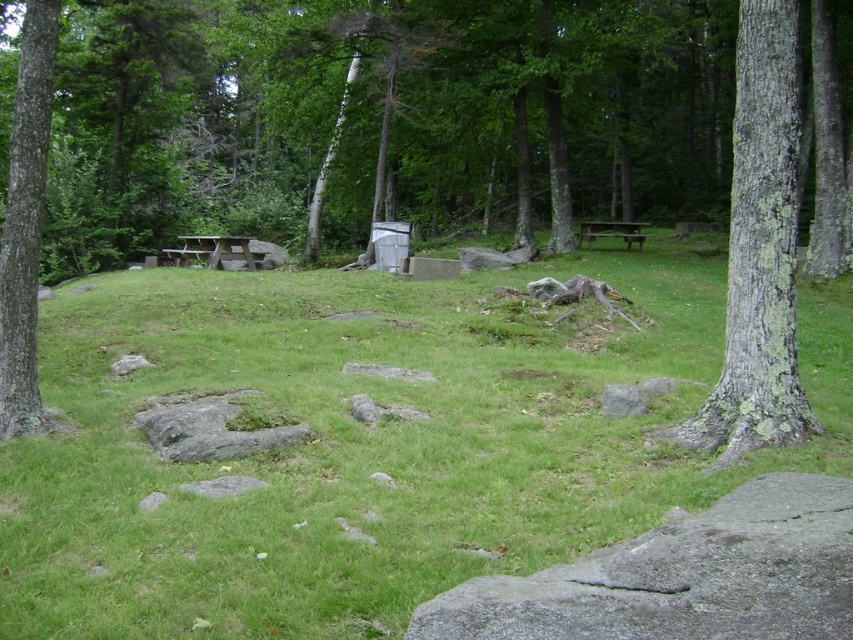
Question: Which of the following is the farthest from the observer?

Choices:
 (A) click(x=634, y=234)
 (B) click(x=238, y=252)
 (C) click(x=19, y=67)
 (D) click(x=206, y=36)

Answer: (D)

Question: Does green rough bark tree at left have a larger size compared to brown wooden picnic table at center?

Choices:
 (A) no
 (B) yes

Answer: (A)

Question: Can you confirm if green rough bark tree at left is smaller than brown wooden picnic table at center?

Choices:
 (A) no
 (B) yes

Answer: (B)

Question: Which object is farther from the camera taking this photo?

Choices:
 (A) wooden picnic table at center
 (B) green grassy at center
 (C) green lichen-covered tree trunk at right
 (D) brown wooden picnic table at center

Answer: (D)

Question: Estimate the real-world distances between objects in this image. Which object is closer to the brown wooden picnic table at center?

Choices:
 (A) green rough bark tree at center
 (B) green grassy at center

Answer: (A)

Question: Is green lichen-covered tree trunk at right above green rough bark tree at left?

Choices:
 (A) yes
 (B) no

Answer: (A)